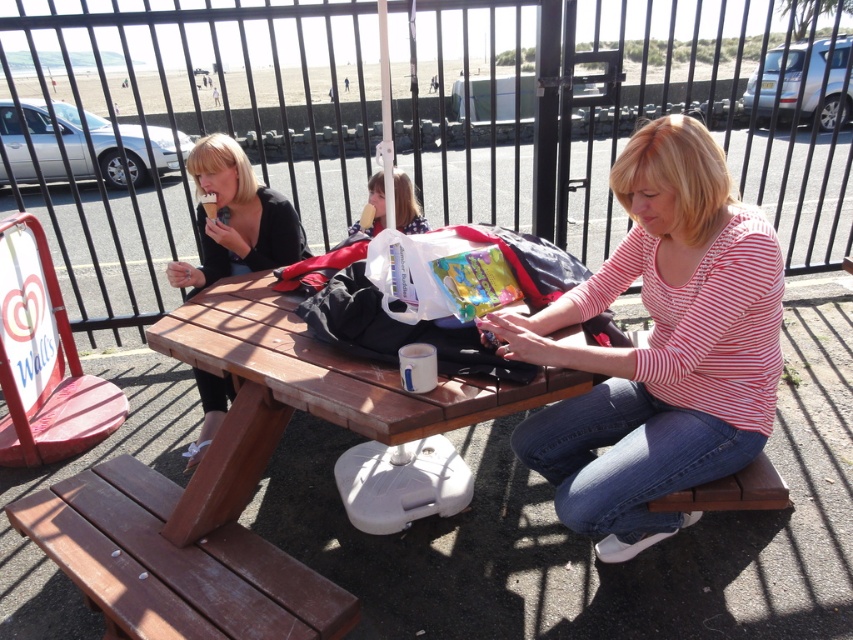
You are planning to place both the matte black ice cream cone at left and the matte plastic ice cream cone at center into a rectangular container. Which cone should be placed first to ensure both fit properly?

The matte plastic ice cream cone at center should be placed first since the matte black ice cream cone at left might be wider and could require more space, ensuring both fit properly.

You are standing at the origin point of the coordinate system in the image. You want to walk to the brown wooden picnic table at center. What direction should you go?

The brown wooden picnic table at center is located at coordinate point 0.614 on the x axis and 0.360 on the y axis. Since you are at the origin point, you should move towards the positive x and positive y direction to reach it.

From the picture: You are planning to buy an ice cream cone and want to choose the smaller one. Which one should you pick between the matte black ice cream cone at left and the matte plastic ice cream cone at center?

The matte plastic ice cream cone at center is smaller than the matte black ice cream cone at left, so you should pick the matte plastic ice cream cone at center.